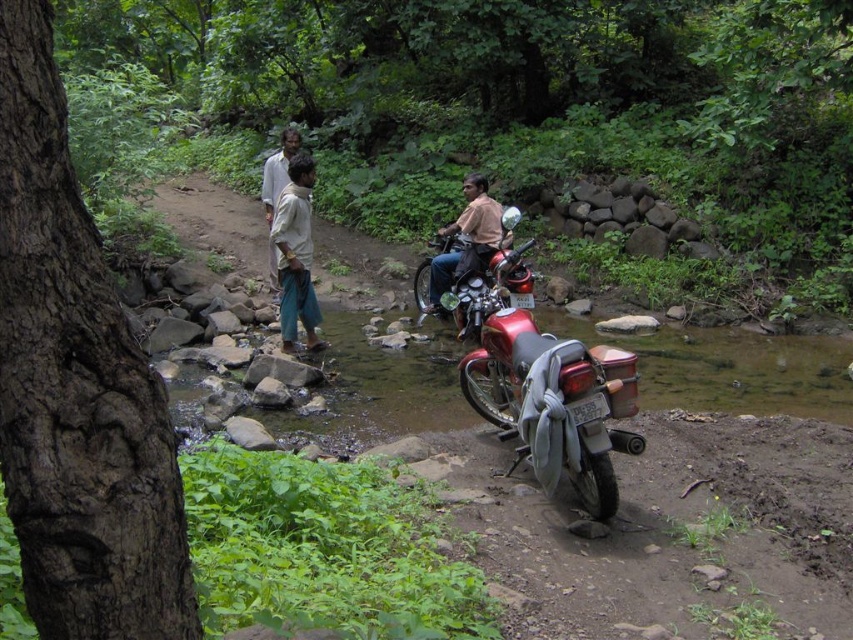
Question: In this image, where is shiny metallic motorcycle at center located relative to light beige fabric pants at center?

Choices:
 (A) above
 (B) below

Answer: (B)

Question: Which point is farther to the camera?

Choices:
 (A) light beige fabric pants at center
 (B) brown leather jacket at center
 (C) shiny metallic motorcycle at center

Answer: (B)

Question: Which point is farther from the camera taking this photo?

Choices:
 (A) (485, 180)
 (B) (283, 285)
 (C) (503, 234)

Answer: (A)

Question: Is the position of shiny metallic motorcycle at center more distant than that of light beige fabric pants at center?

Choices:
 (A) yes
 (B) no

Answer: (B)

Question: Can you confirm if shiny metallic motorcycle at center is positioned to the right of brown leather jacket at center?

Choices:
 (A) no
 (B) yes

Answer: (B)

Question: Which object is positioned closest to the shiny metallic motorcycle at center?

Choices:
 (A) light beige fabric pants at center
 (B) brown leather jacket at center

Answer: (B)